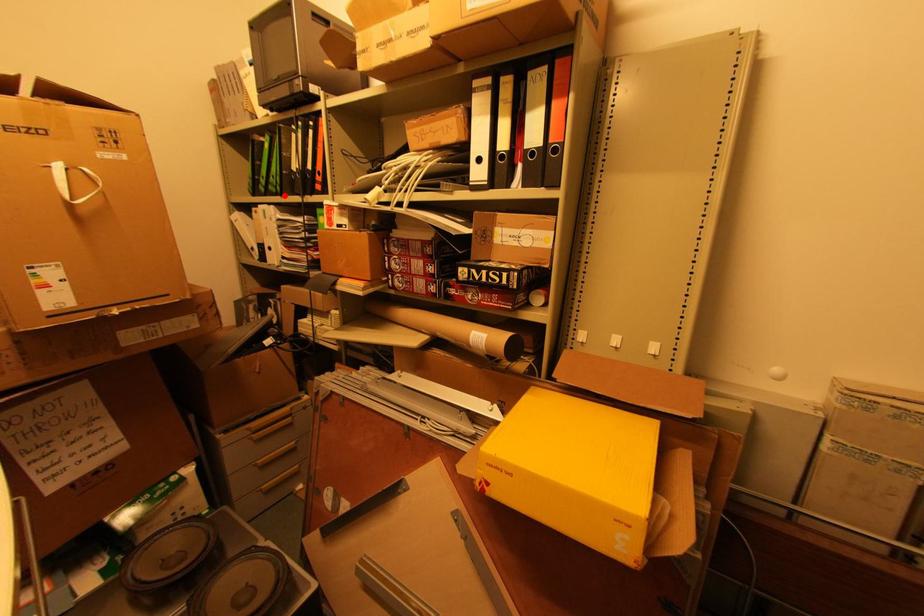
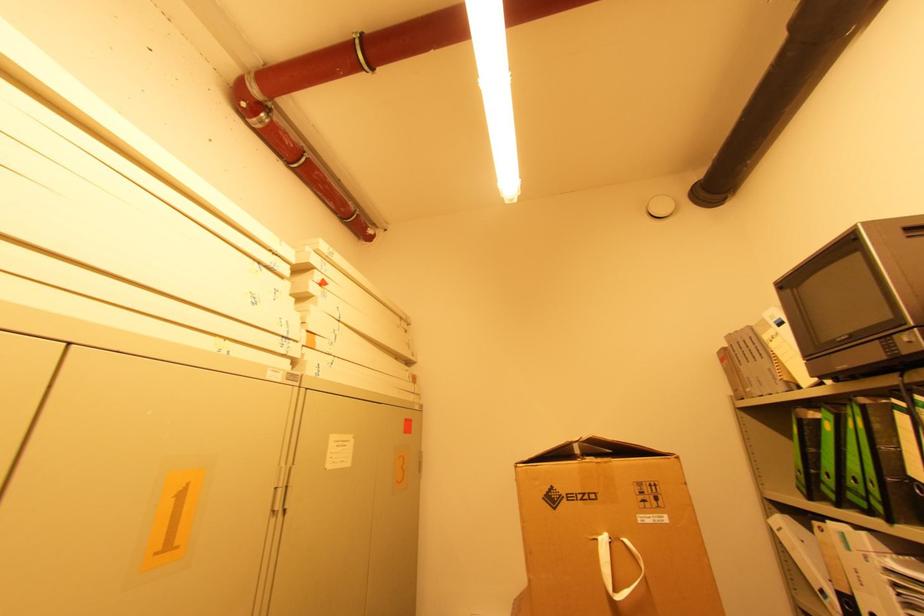
Where in the second image is the point corresponding to the highlighted location from the first image?

(894, 522)